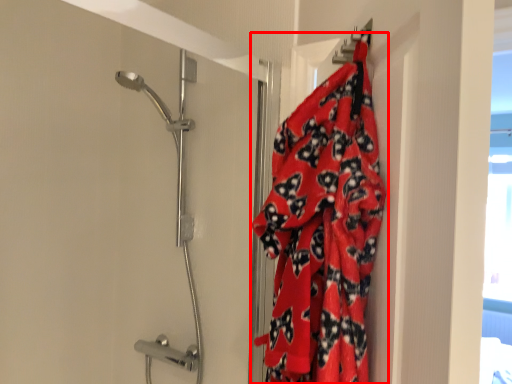
Question: Observing the image, what is the correct spatial positioning of blanket (annotated by the red box) in reference to shower door?

Choices:
 (A) right
 (B) left

Answer: (A)